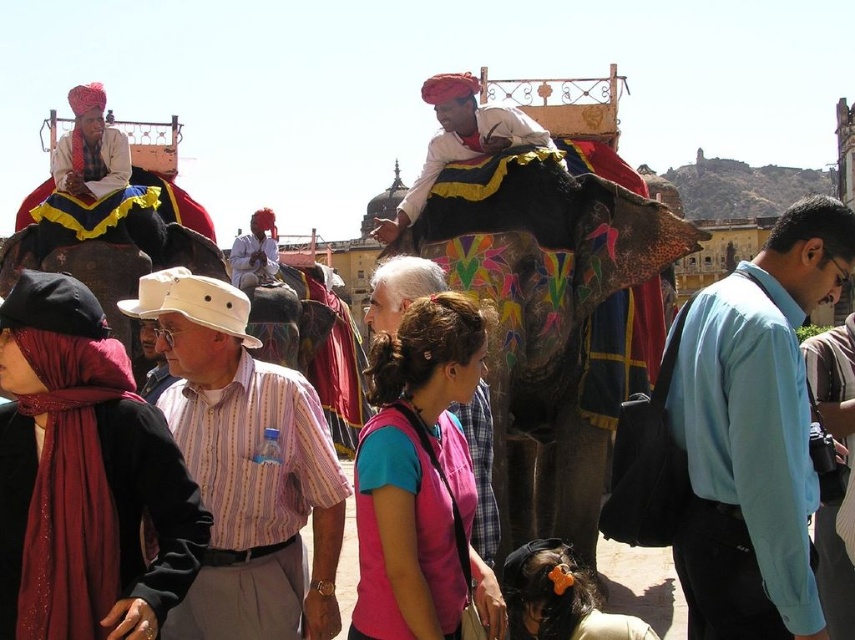
Where is the black fabric scarf at left located in the image?

The black fabric scarf at left is located at point (84,477) in the image.

You are a photographer trying to capture a group photo of the light blue shirt at center and striped cotton shirt at center. Which shirt should you focus on to ensure it fits entirely in the frame if your camera has a limited horizontal field of view?

The light blue shirt at center has a lesser width compared to striped cotton shirt at center, so focusing on the light blue shirt at center would ensure it fits entirely in the frame.